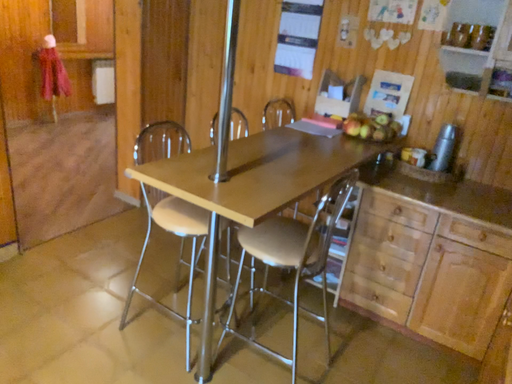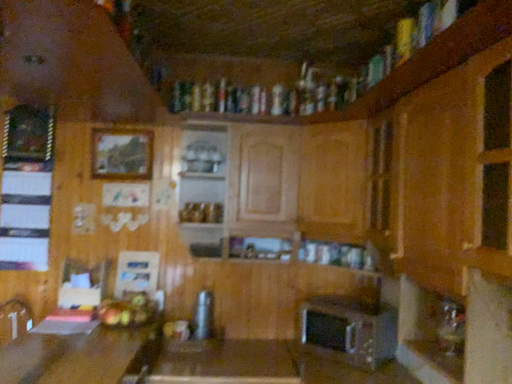
Question: How did the camera likely rotate when shooting the video?

Choices:
 (A) rotated left
 (B) rotated right

Answer: (B)